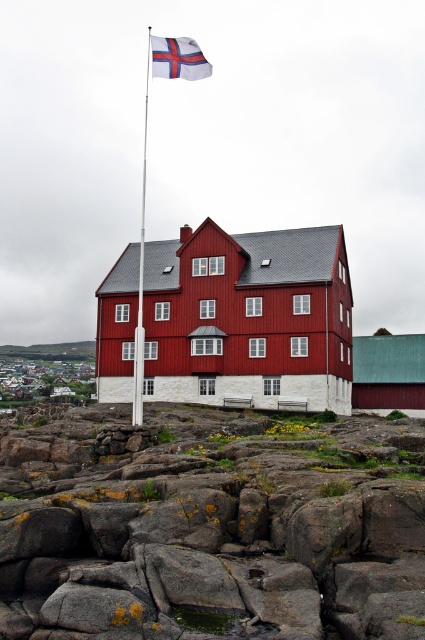
Question: Which object is closer to the camera taking this photo?

Choices:
 (A) white fabric flag at upper center
 (B) matte red building at center
 (C) rusty rock at center

Answer: (C)

Question: Which object appears closest to the camera in this image?

Choices:
 (A) green wooden barn at center
 (B) white fabric flag at upper center
 (C) rusty rock at center
 (D) matte red building at center

Answer: (C)

Question: Is the position of matte red building at center less distant than that of white plastic flag pole at upper center?

Choices:
 (A) yes
 (B) no

Answer: (B)

Question: Can you confirm if green wooden barn at center is wider than white plastic flag pole at upper center?

Choices:
 (A) no
 (B) yes

Answer: (A)

Question: Can you confirm if green wooden barn at center is wider than white fabric flag at upper center?

Choices:
 (A) no
 (B) yes

Answer: (A)

Question: Which point appears farthest from the camera in this image?

Choices:
 (A) (323, 369)
 (B) (401, 394)
 (C) (164, 552)

Answer: (B)